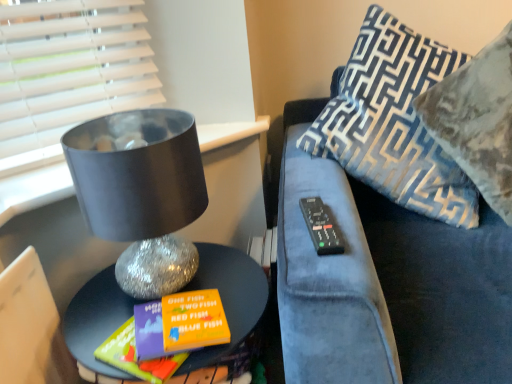
Question: Would you say velvet-patterned pillow at upper right, the 1th pillow in the right-to-left sequence, contains shiny metallic table at lower left?

Choices:
 (A) yes
 (B) no

Answer: (B)

Question: From the image's perspective, is velvet-patterned pillow at upper right, positioned as the second pillow in left-to-right order, beneath shiny metallic table at lower left?

Choices:
 (A) yes
 (B) no

Answer: (B)

Question: Could you tell me if velvet-patterned pillow at upper right, positioned as the second pillow in left-to-right order, is facing shiny metallic table at lower left?

Choices:
 (A) no
 (B) yes

Answer: (A)

Question: Is shiny metallic table at lower left at the back of velvet-patterned pillow at upper right, the 1th pillow in the right-to-left sequence?

Choices:
 (A) yes
 (B) no

Answer: (B)

Question: Is velvet-patterned pillow at upper right, positioned as the second pillow in left-to-right order, positioned behind shiny metallic table at lower left?

Choices:
 (A) no
 (B) yes

Answer: (B)

Question: Is velvet-patterned pillow at upper right, positioned as the second pillow in left-to-right order, positioned before shiny metallic table at lower left?

Choices:
 (A) yes
 (B) no

Answer: (B)

Question: Is blue patterned pillow at right, which ranks as the first pillow in left-to-right order, positioned beyond the bounds of shiny metallic table at lower left?

Choices:
 (A) yes
 (B) no

Answer: (A)

Question: Considering the relative sizes of blue patterned pillow at right, acting as the second pillow starting from the right, and shiny metallic table at lower left in the image provided, is blue patterned pillow at right, acting as the second pillow starting from the right, shorter than shiny metallic table at lower left?

Choices:
 (A) yes
 (B) no

Answer: (B)

Question: Is the position of blue patterned pillow at right, which ranks as the first pillow in left-to-right order, more distant than that of shiny metallic table at lower left?

Choices:
 (A) no
 (B) yes

Answer: (B)

Question: Can you confirm if blue patterned pillow at right, which ranks as the first pillow in left-to-right order, is wider than shiny metallic table at lower left?

Choices:
 (A) yes
 (B) no

Answer: (B)

Question: Is blue patterned pillow at right, acting as the second pillow starting from the right, beside shiny metallic table at lower left?

Choices:
 (A) no
 (B) yes

Answer: (A)

Question: Is there a large distance between blue patterned pillow at right, which ranks as the first pillow in left-to-right order, and shiny metallic table at lower left?

Choices:
 (A) yes
 (B) no

Answer: (B)

Question: Is blue patterned pillow at right, which ranks as the first pillow in left-to-right order, taller than velvet-patterned pillow at upper right, the 1th pillow in the right-to-left sequence?

Choices:
 (A) yes
 (B) no

Answer: (A)